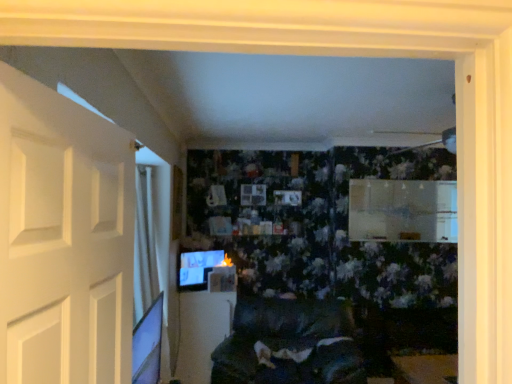
Question: Is point (304, 377) positioned closer to the camera than point (114, 382)?

Choices:
 (A) closer
 (B) farther

Answer: (B)

Question: Looking at the image, does velvet dark gray couch at center seem bigger or smaller compared to white matte door at left?

Choices:
 (A) big
 (B) small

Answer: (A)

Question: Which of these objects is positioned farthest from the matte black monitor at lower left?

Choices:
 (A) white matte door at left
 (B) velvet dark gray couch at center
 (C) white glossy table at center

Answer: (A)

Question: Based on their relative distances, which object is nearer to the white matte door at left?

Choices:
 (A) white glossy table at center
 (B) velvet dark gray couch at center
 (C) matte black monitor at lower left

Answer: (B)